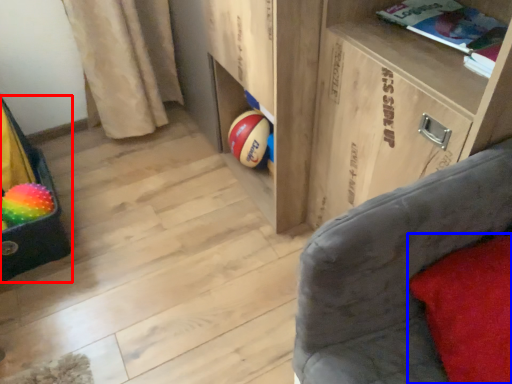
Question: Which object is closer to the camera taking this photo, bean bag chair (highlighted by a red box) or pillow (highlighted by a blue box)?

Choices:
 (A) bean bag chair
 (B) pillow

Answer: (B)